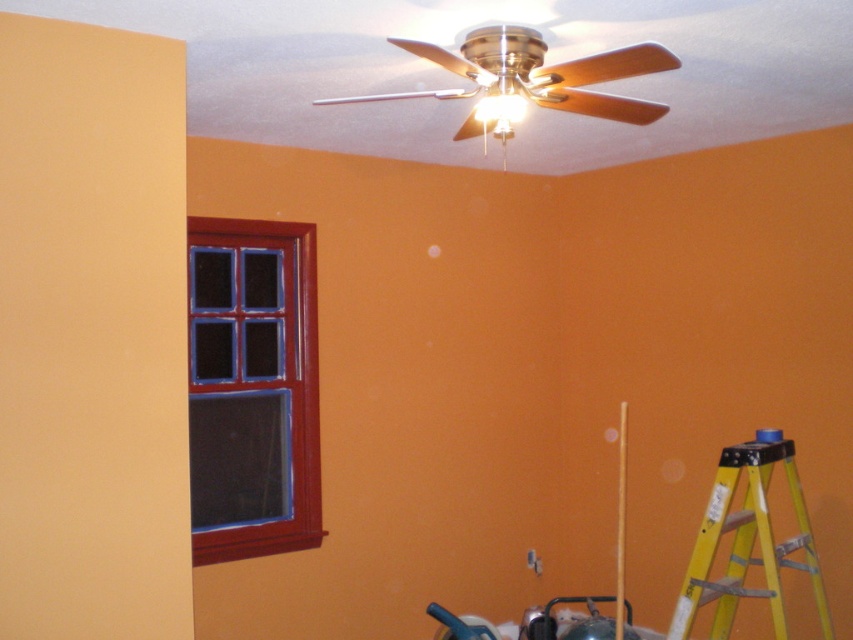
You are standing in the room and want to hang a painting exactly at the same height as the brushed metal fan at upper center. What coordinates should you aim for?

You should aim for the coordinates point at (531, 81) to hang the painting at the same height as the brushed metal fan at upper center.

You are a painter who needs to reach the matte red wooden window at left to clean it. You have a ladder that is 5 feet long. The brushed metal fan at upper center is in the way. Is the ladder long enough to safely reach the window without touching the fan?

The matte red wooden window at left is 4.93 feet from the brushed metal fan at upper center. Since the ladder is 5 feet long, it is just long enough to reach the window without touching the fan.